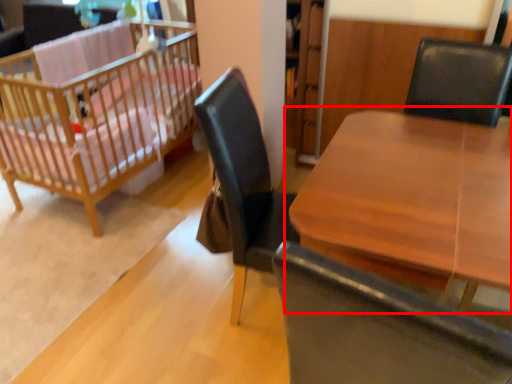
Question: From the image's perspective, what is the correct spatial relationship of table (annotated by the red box) in relation to infant bed?

Choices:
 (A) below
 (B) above

Answer: (A)